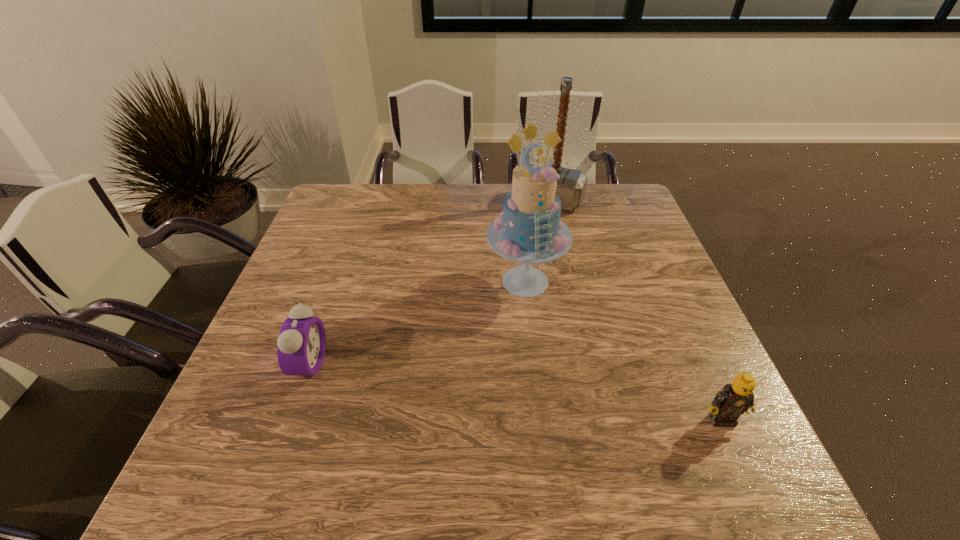
This screenshot has height=540, width=960. Identify the location of vacant space on the desktop that is between the third farthest object and the Lego and is positioned with a ladder on the side of the third nearest object. (493, 389).

Find the location of a particular element. The width and height of the screenshot is (960, 540). free space on the desktop that is between the third farthest object and the nearest object and is positioned on the striking surface of the farthest object is located at coordinates (445, 382).